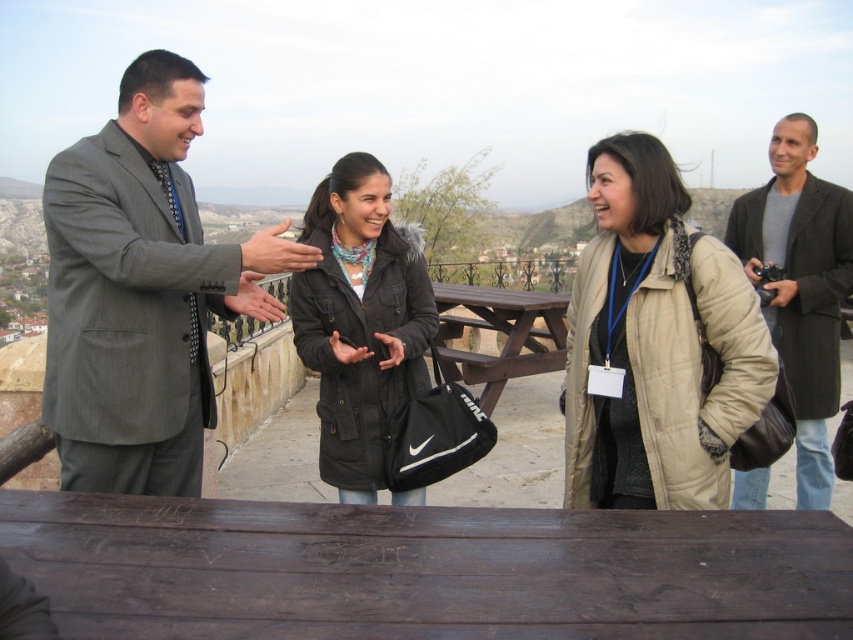
You are organizing a photo shoot and need to arrange two outfits for a group photo. The gray suit at left and the beige quilted jacket at center must be placed side by side. Which outfit requires more horizontal space to avoid overlapping?

The gray suit at left requires more horizontal space because its width surpasses that of the beige quilted jacket at center.

You are a photographer trying to capture a photo of the dark gray coat at right without including the dark wood table at lower center in the frame. Is this possible given their current positions?

The dark wood table at lower center is thinner than the dark gray coat at right. Since the table is thinner, it might not fully block the view of the coat, so it is possible to position the camera in a way that excludes the table from the frame while focusing on the coat.